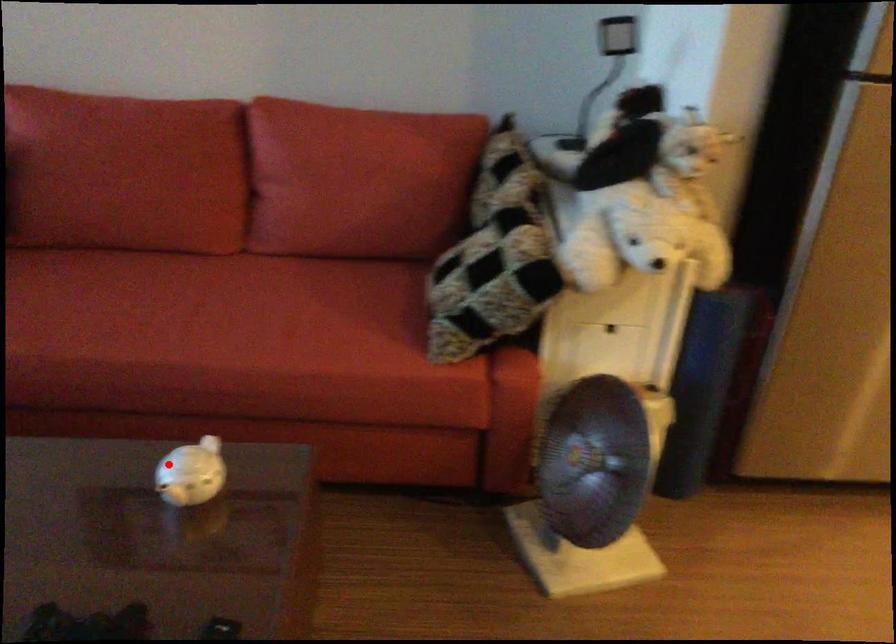
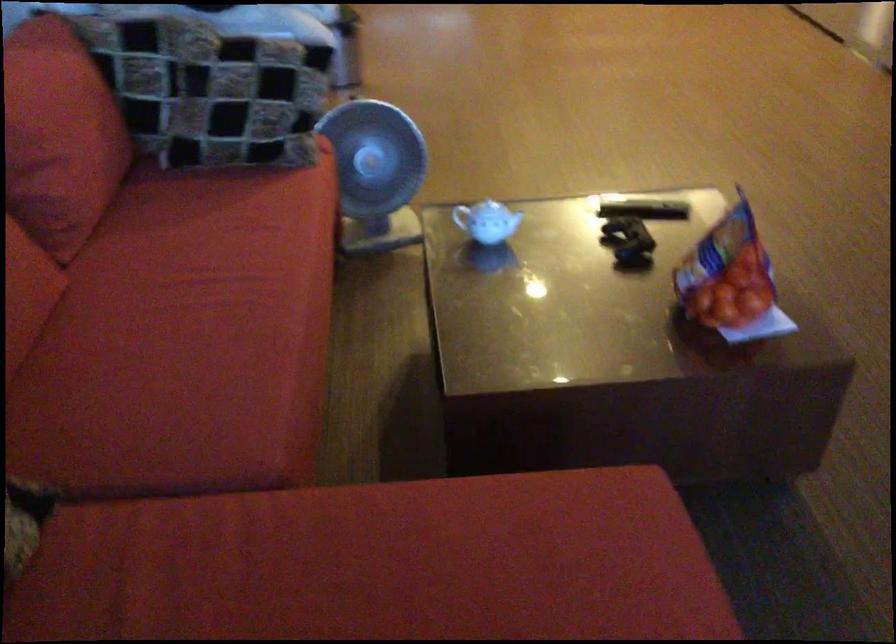
Question: I am providing you with two images of the same scene from different viewpoints. Given a red point in image1, look at the same physical point in image2. Is it:

Choices:
 (A) Closer to the viewpoint
 (B) Farther from the viewpoint

Answer: (B)